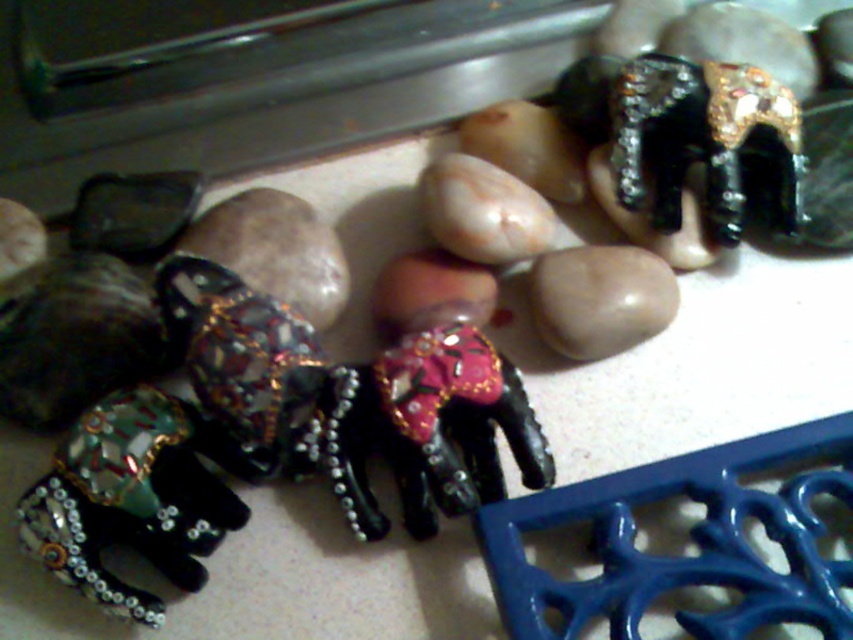
Question: Can you confirm if black glossy elephant at center is positioned to the right of smooth beige rock at center?

Choices:
 (A) yes
 (B) no

Answer: (B)

Question: Can you confirm if black glossy elephant at center is thinner than smooth beige rock at center?

Choices:
 (A) no
 (B) yes

Answer: (A)

Question: In this image, where is metallic beaded elephant at lower left located relative to black glossy elephant at center?

Choices:
 (A) left
 (B) right

Answer: (A)

Question: Which point is closer to the camera?

Choices:
 (A) black glossy elephant at center
 (B) smooth beige rock at center
 (C) metallic beaded elephant at lower left

Answer: (C)

Question: Among these points, which one is farthest from the camera?

Choices:
 (A) (622, 320)
 (B) (173, 436)

Answer: (A)

Question: Which point is closer to the camera?

Choices:
 (A) metallic beaded elephant at lower left
 (B) smooth beige rock at center

Answer: (A)